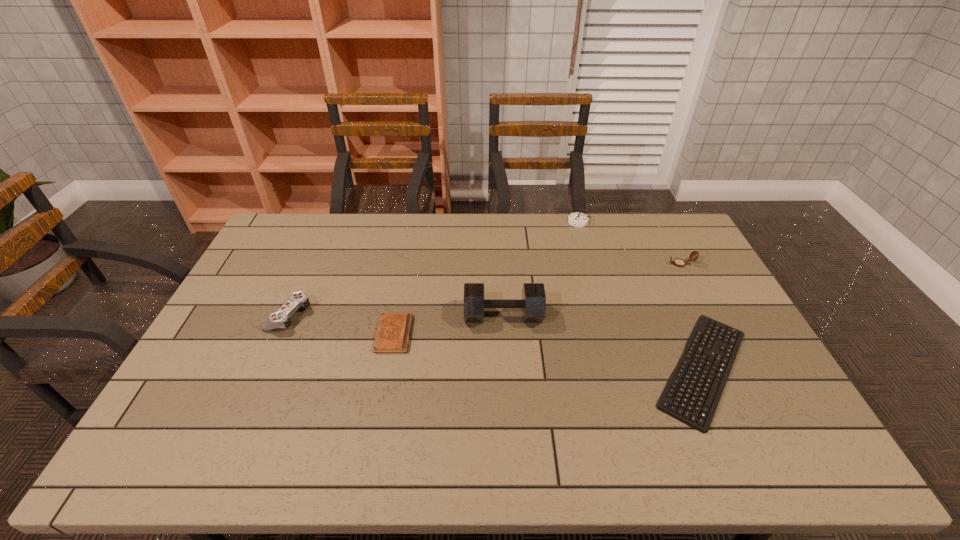
At what (x,y) coordinates should I click in order to perform the action: click on compass at the right edge. Please return your answer as a coordinate pair (x, y). The height and width of the screenshot is (540, 960). Looking at the image, I should click on (678, 262).

Find the location of a particular element. Image resolution: width=960 pixels, height=540 pixels. computer keyboard positioned at the right edge is located at coordinates (667, 396).

At what (x,y) coordinates should I click in order to perform the action: click on object present at the near right corner. Please return your answer as a coordinate pair (x, y). This screenshot has height=540, width=960. Looking at the image, I should click on (667, 396).

Locate an element on the screen. This screenshot has width=960, height=540. vacant space at the far edge of the desktop is located at coordinates (527, 247).

I want to click on blank space at the near edge of the desktop, so click(294, 460).

In the image, there is a desktop. Identify the location of free space at the left edge. (188, 387).

Where is `vacant space at the right edge of the desktop`? The height and width of the screenshot is (540, 960). vacant space at the right edge of the desktop is located at coordinates (731, 314).

Where is `free space at the far left corner`? free space at the far left corner is located at coordinates (276, 241).

Find the location of a particular element. free space that is in between the tallest object and the left compass is located at coordinates (540, 268).

At what (x,y) coordinates should I click in order to perform the action: click on vacant space in between the farthest object and the second farthest object. Please return your answer as a coordinate pair (x, y). The image size is (960, 540). Looking at the image, I should click on (630, 243).